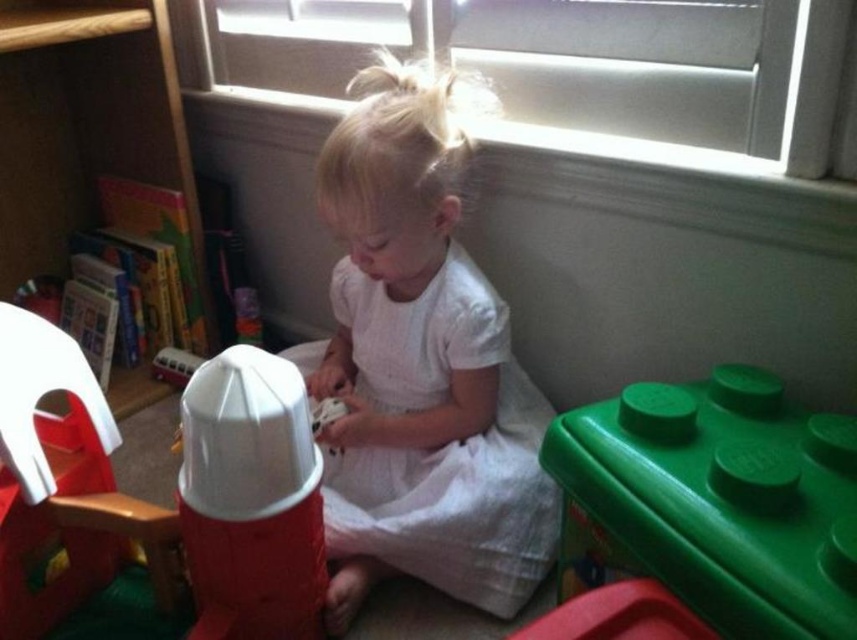
Measure the distance between point (692, 474) and camera.

The distance of point (692, 474) from camera is 77.70 centimeters.

Between green plastic container at lower right and white cotton dress at center, which one has less height?

With less height is green plastic container at lower right.

The width and height of the screenshot is (857, 640). What do you see at coordinates (712, 502) in the screenshot? I see `green plastic container at lower right` at bounding box center [712, 502].

What are the coordinates of `green plastic container at lower right` in the screenshot? It's located at (712, 502).

Is white cotton dress at center taller than wooden bookshelf at left?

Incorrect, white cotton dress at center's height is not larger of wooden bookshelf at left's.

Is white cotton dress at center thinner than wooden bookshelf at left?

No.

Is point (459, 300) positioned behind point (159, 68)?

No, (459, 300) is closer to viewer.

What are the coordinates of `white cotton dress at center` in the screenshot? It's located at (441, 444).

Does green plastic container at lower right come in front of wooden bookshelf at left?

Yes, it is.

Is green plastic container at lower right taller than wooden bookshelf at left?

No, green plastic container at lower right is not taller than wooden bookshelf at left.

Is point (718, 563) positioned after point (3, 280)?

No, it is in front of (3, 280).

Identify the location of green plastic container at lower right. (712, 502).